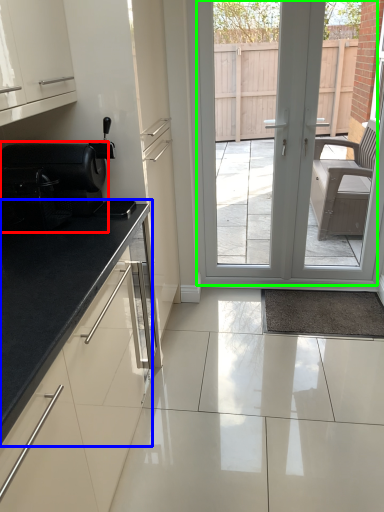
Question: Which object is the farthest from appliance (highlighted by a red box)? Choose among these: countertop (highlighted by a blue box) or door (highlighted by a green box).

Choices:
 (A) countertop
 (B) door

Answer: (B)